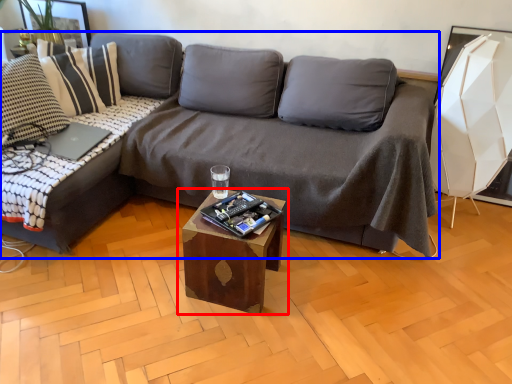
Question: Which of the following is the farthest to the observer, table (highlighted by a red box) or studio couch (highlighted by a blue box)?

Choices:
 (A) table
 (B) studio couch

Answer: (A)